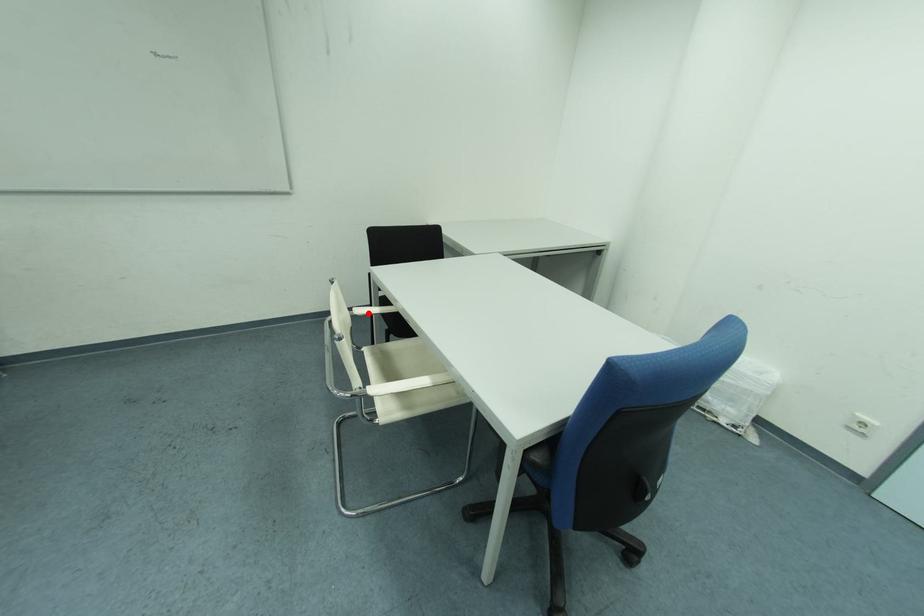
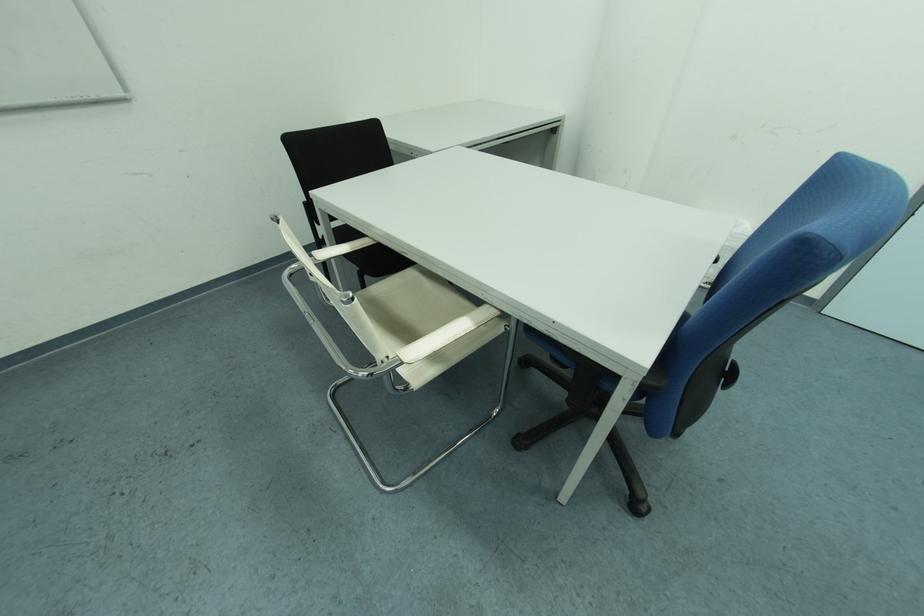
Question: I am providing you with two images of the same scene from different viewpoints. A red point is shown in image1. For the corresponding object point in image2, is it positioned nearer or farther from the camera?

Choices:
 (A) Nearer
 (B) Farther

Answer: (A)